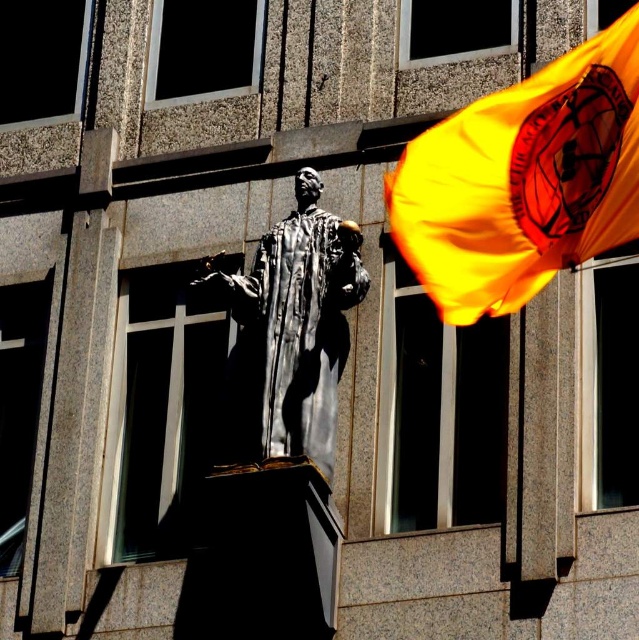
Is shiny orange flag at upper right further to the viewer compared to polished silver statue at center?

No, shiny orange flag at upper right is closer to the viewer.

How much distance is there between shiny orange flag at upper right and polished silver statue at center?

shiny orange flag at upper right is 6.34 meters from polished silver statue at center.

Is point (502, 124) positioned behind point (288, 262)?

Yes.

At what (x,y) coordinates should I click in order to perform the action: click on shiny orange flag at upper right. Please return your answer as a coordinate pair (x, y). Looking at the image, I should click on (523, 180).